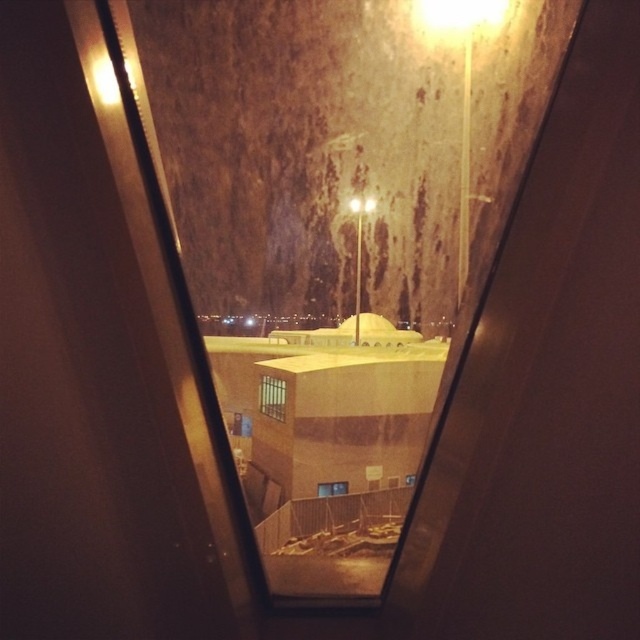
You are inside a car at night and notice two points reflected on the window. The first point is at coordinates point (268, 406) and the second point is at point (339, 492). Which point is closer to you?

Point (268, 406) is further to the viewer than point (339, 492), so the closer point to you is point (339, 492).

You are inside a car at night and want to see the outside clearly through the window. Is the area around the point marked as point (273, 396) on the window obstructed or clear?

The point (273, 396) marks clear glass window at center, so the area around it is clear.

You are a passenger in a car at night. You notice two windows in front of you. One is labeled as the clear glass window at center and the other as the transparent glass window at center. Which window is higher up?

The clear glass window at center is located above the transparent glass window at center, so the clear glass window at center is higher up.